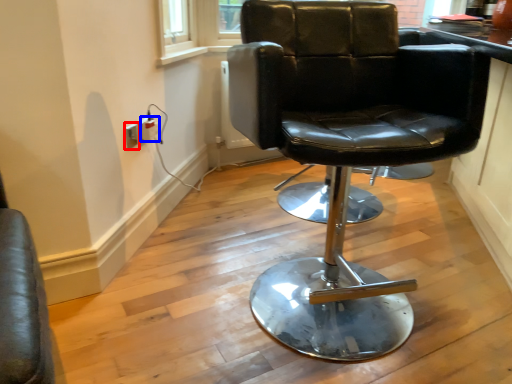
Question: Which of the following is the closest to the observer, electric outlet (highlighted by a red box) or electric outlet (highlighted by a blue box)?

Choices:
 (A) electric outlet
 (B) electric outlet

Answer: (A)